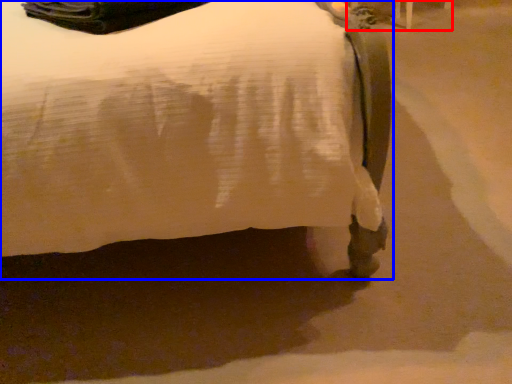
Question: Among these objects, which one is farthest to the camera, furniture (highlighted by a red box) or bed (highlighted by a blue box)?

Choices:
 (A) furniture
 (B) bed

Answer: (A)